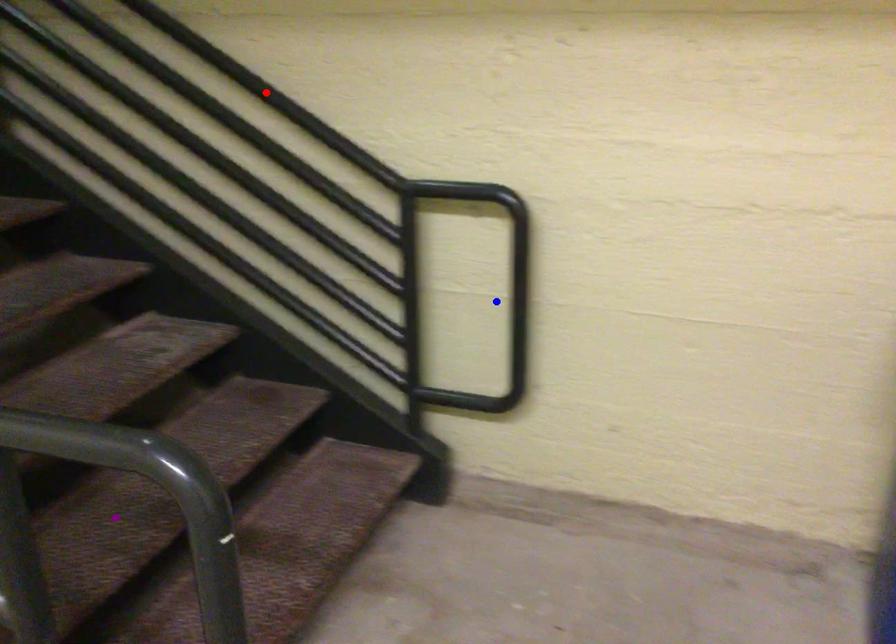
From the picture: Order these from nearest to farthest:
purple point
blue point
red point

purple point → blue point → red point